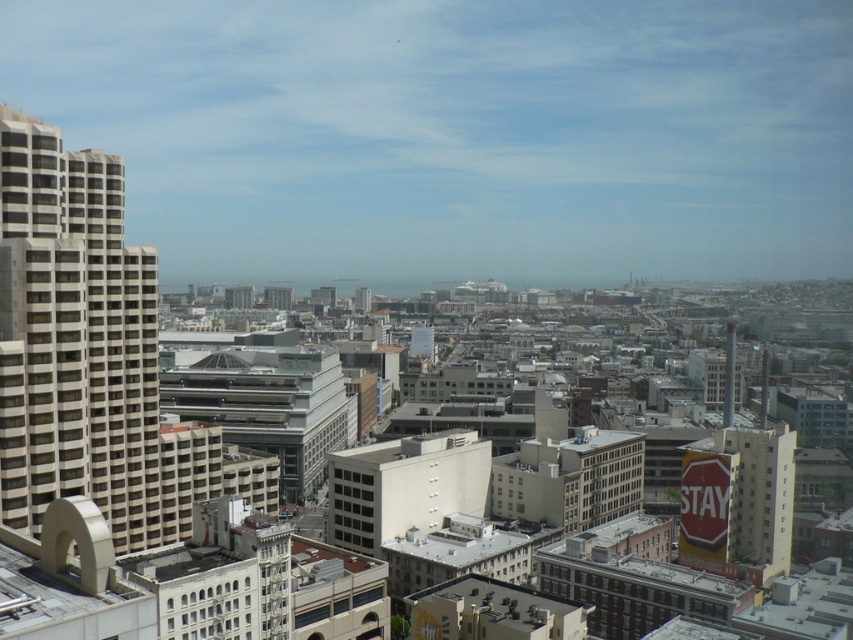
You are standing at point (x=76, y=336) in the cityscape. What can you see at this location?

At point (x=76, y=336) lies beige concrete building at left.